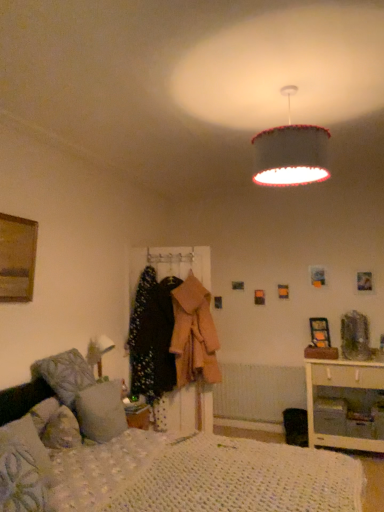
Question: From a real-world perspective, does wooden picture frame at right, the first picture frame in the right-to-left sequence, sit lower than white wood nightstand at lower right?

Choices:
 (A) yes
 (B) no

Answer: (B)

Question: Can you confirm if wooden picture frame at right, the 2th picture frame in the left-to-right sequence, is shorter than white wood nightstand at lower right?

Choices:
 (A) yes
 (B) no

Answer: (A)

Question: Is wooden picture frame at right, which appears as the 1th picture frame when viewed from the back, far away from white wood nightstand at lower right?

Choices:
 (A) yes
 (B) no

Answer: (B)

Question: Is wooden picture frame at right, the first picture frame in the right-to-left sequence, wider than white wood nightstand at lower right?

Choices:
 (A) yes
 (B) no

Answer: (B)

Question: Is the depth of wooden picture frame at right, the first picture frame from the bottom, greater than that of white wood nightstand at lower right?

Choices:
 (A) no
 (B) yes

Answer: (B)

Question: In terms of height, does floral fabric coat at center, which is the 2th clothing in right-to-left order, look taller or shorter compared to white knitted bed at lower left?

Choices:
 (A) tall
 (B) short

Answer: (A)

Question: Is point (139, 371) closer or farther from the camera than point (296, 479)?

Choices:
 (A) farther
 (B) closer

Answer: (A)

Question: Is floral fabric coat at center, placed as the first clothing when sorted from left to right, in front of or behind white knitted bed at lower left in the image?

Choices:
 (A) front
 (B) behind

Answer: (B)

Question: Is floral fabric coat at center, placed as the first clothing when sorted from left to right, situated inside white knitted bed at lower left or outside?

Choices:
 (A) inside
 (B) outside

Answer: (B)

Question: Considering the positions of white textured radiator at lower center and fluffy white pillow at lower left, which is the 2th pillow from back to front, in the image, is white textured radiator at lower center wider or thinner than fluffy white pillow at lower left, which is the 2th pillow from back to front,?

Choices:
 (A) wide
 (B) thin

Answer: (B)

Question: From a real-world perspective, is white textured radiator at lower center positioned above or below fluffy white pillow at lower left, which is the 2th pillow from back to front?

Choices:
 (A) above
 (B) below

Answer: (B)

Question: Looking at the image, does white textured radiator at lower center seem bigger or smaller compared to fluffy white pillow at lower left, which is counted as the first pillow, starting from the front?

Choices:
 (A) small
 (B) big

Answer: (A)

Question: Is point (269, 414) positioned closer to the camera than point (16, 492)?

Choices:
 (A) farther
 (B) closer

Answer: (A)

Question: From a real-world perspective, is floral fabric coat at center, placed as the first clothing when sorted from left to right, above or below wooden picture frame at right, the first picture frame in the right-to-left sequence?

Choices:
 (A) above
 (B) below

Answer: (B)

Question: Based on their sizes in the image, would you say floral fabric coat at center, placed as the first clothing when sorted from left to right, is bigger or smaller than wooden picture frame at right, the 2th picture frame when ordered from front to back?

Choices:
 (A) small
 (B) big

Answer: (B)